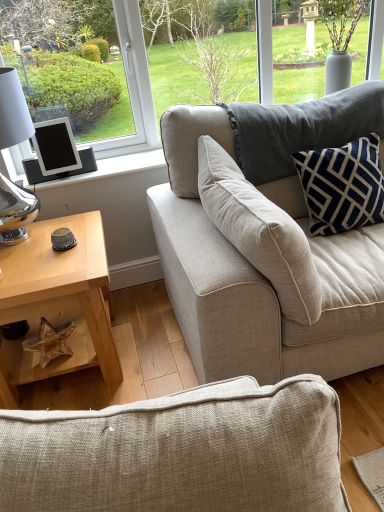
Question: In terms of size, does light wood/texture coffee table at lower left appear bigger or smaller than navy velvet pillow at upper right?

Choices:
 (A) small
 (B) big

Answer: (B)

Question: In the image, is light wood/texture coffee table at lower left positioned in front of or behind navy velvet pillow at upper right?

Choices:
 (A) behind
 (B) front

Answer: (B)

Question: Which is nearer to the beige fabric couch at upper right?

Choices:
 (A) black matte tablet at left
 (B) light wood/texture coffee table at lower left
 (C) navy velvet pillow at upper right

Answer: (C)

Question: Which object is positioned farthest from the black matte tablet at left?

Choices:
 (A) light wood/texture coffee table at lower left
 (B) beige fabric couch at upper right
 (C) navy velvet pillow at upper right

Answer: (C)